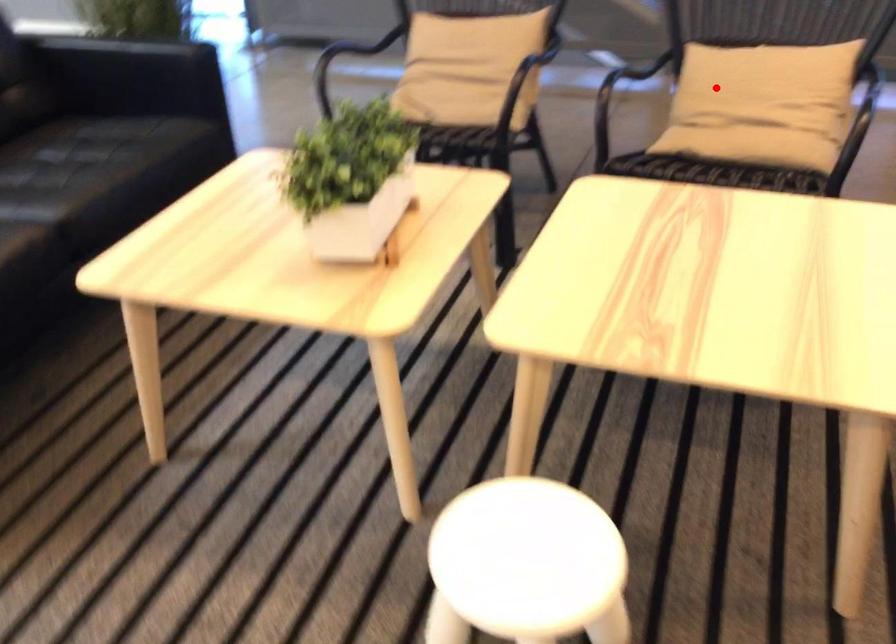
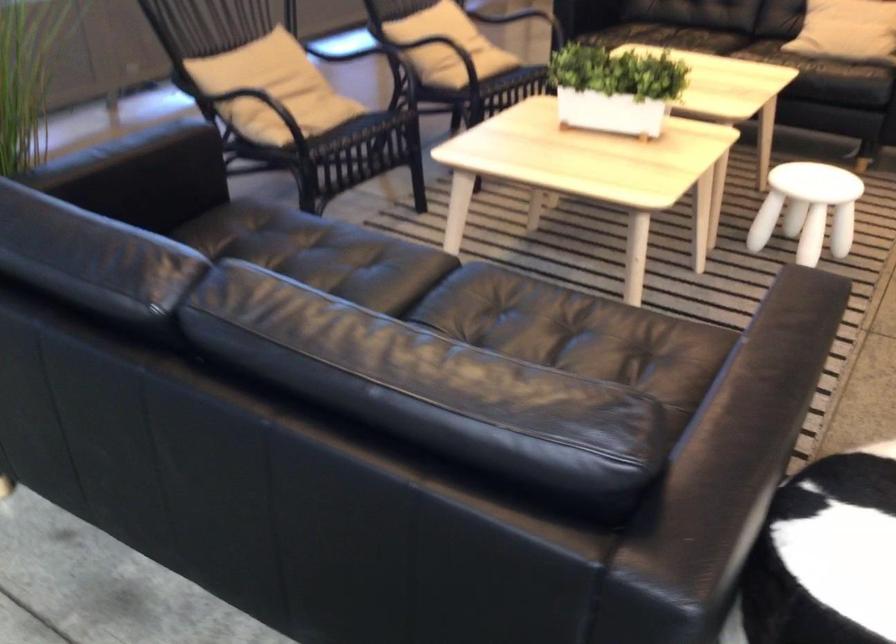
Question: I am providing you with two images of the same scene from different viewpoints. In image1, a red point is highlighted. Considering the same 3D point in image2, which of the following is correct?

Choices:
 (A) It is closer
 (B) It is farther

Answer: (B)